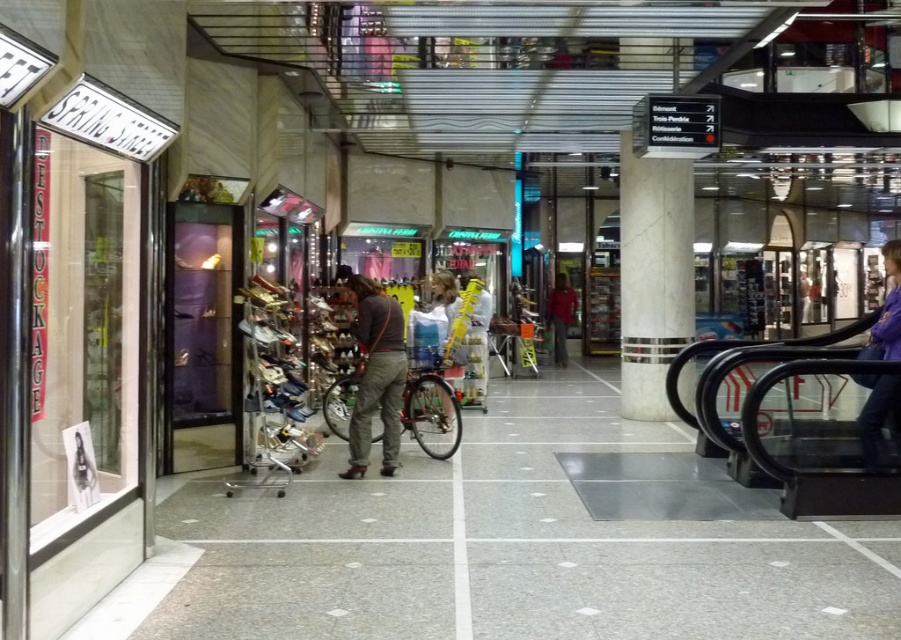
Can you confirm if dark gray pants at center is positioned to the left of shiny metallic bicycle at center?

Yes, dark gray pants at center is to the left of shiny metallic bicycle at center.

Does dark gray pants at center have a smaller size compared to shiny metallic bicycle at center?

Indeed, dark gray pants at center has a smaller size compared to shiny metallic bicycle at center.

Does point (390, 376) lie behind point (340, 390)?

That is False.

The image size is (901, 640). Identify the location of dark gray pants at center. (376, 376).

Image resolution: width=901 pixels, height=640 pixels. What do you see at coordinates (431, 413) in the screenshot? I see `shiny metallic bicycle at center` at bounding box center [431, 413].

Where is `shiny metallic bicycle at center`? shiny metallic bicycle at center is located at coordinates (431, 413).

Identify the location of purple fabric jacket at lower right. This screenshot has height=640, width=901. (879, 417).

Which is more to the right, purple fabric jacket at lower right or red fabric jacket at center?

From the viewer's perspective, purple fabric jacket at lower right appears more on the right side.

Which is in front, point (889, 330) or point (558, 362)?

Positioned in front is point (889, 330).

Find the location of a particular element. The image size is (901, 640). purple fabric jacket at lower right is located at coordinates (879, 417).